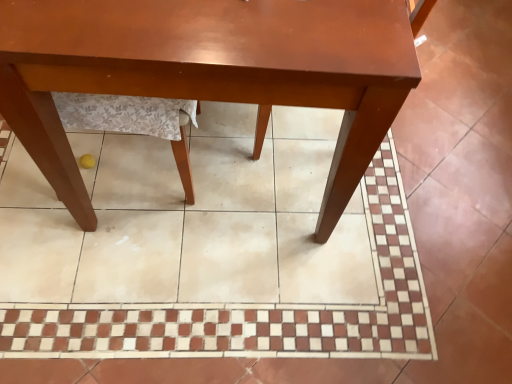
Question: Is brown glossy tile at center further to camera compared to matte wood table at center?

Choices:
 (A) no
 (B) yes

Answer: (B)

Question: From a real-world perspective, is brown glossy tile at center positioned over matte wood table at center based on gravity?

Choices:
 (A) yes
 (B) no

Answer: (B)

Question: Would you consider brown glossy tile at center to be distant from matte wood table at center?

Choices:
 (A) no
 (B) yes

Answer: (A)

Question: From the image's perspective, is brown glossy tile at center beneath matte wood table at center?

Choices:
 (A) yes
 (B) no

Answer: (A)

Question: Does brown glossy tile at center have a greater width compared to matte wood table at center?

Choices:
 (A) no
 (B) yes

Answer: (B)

Question: Is brown glossy tile at center in front of matte wood table at center?

Choices:
 (A) no
 (B) yes

Answer: (A)

Question: From the image's perspective, is matte wood table at center on brown glossy tile at center?

Choices:
 (A) yes
 (B) no

Answer: (A)

Question: From a real-world perspective, does matte wood table at center stand above brown glossy tile at center?

Choices:
 (A) no
 (B) yes

Answer: (B)

Question: Can you confirm if matte wood table at center is thinner than brown glossy tile at center?

Choices:
 (A) yes
 (B) no

Answer: (A)

Question: Is matte wood table at center located outside brown glossy tile at center?

Choices:
 (A) yes
 (B) no

Answer: (A)

Question: Is there a large distance between matte wood table at center and brown glossy tile at center?

Choices:
 (A) yes
 (B) no

Answer: (B)

Question: Is brown glossy tile at center surrounded by matte wood table at center?

Choices:
 (A) yes
 (B) no

Answer: (B)

Question: Considering the relative positions of matte wood table at center and brown glossy tile at center in the image provided, is matte wood table at center to the left or to the right of brown glossy tile at center?

Choices:
 (A) left
 (B) right

Answer: (A)